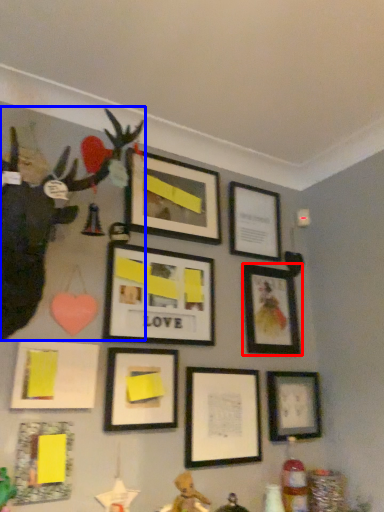
Question: Which object appears farthest to the camera in this image, picture frame (highlighted by a red box) or toy (highlighted by a blue box)?

Choices:
 (A) picture frame
 (B) toy

Answer: (A)